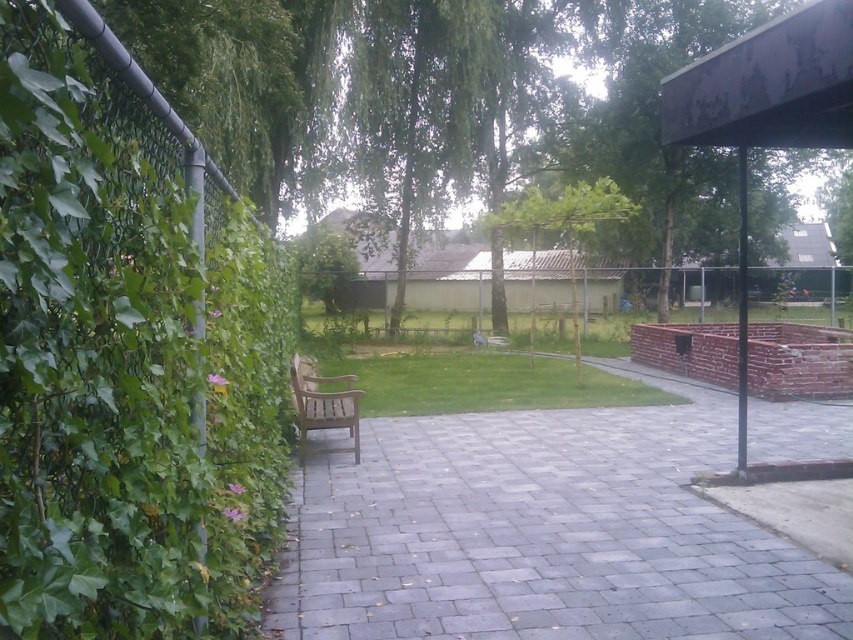
How much distance is there between gray stone path at center and green leafy tree at upper right?

gray stone path at center is 9.29 meters from green leafy tree at upper right.

Does gray stone path at center appear on the right side of green leafy tree at upper right?

In fact, gray stone path at center is to the left of green leafy tree at upper right.

The image size is (853, 640). What do you see at coordinates (543, 534) in the screenshot?
I see `gray stone path at center` at bounding box center [543, 534].

Identify the location of gray stone path at center. (543, 534).

Between gray stone path at center and wooden bench at center, which one appears on the right side from the viewer's perspective?

gray stone path at center

Between point (666, 493) and point (335, 419), which one is positioned in front?

Point (666, 493)

At what (x,y) coordinates should I click in order to perform the action: click on gray stone path at center. Please return your answer as a coordinate pair (x, y). The width and height of the screenshot is (853, 640). Looking at the image, I should click on (543, 534).

Between green leafy hedge at left and gray stone path at center, which one is positioned lower?

gray stone path at center

Identify the location of green leafy hedge at left. (126, 364).